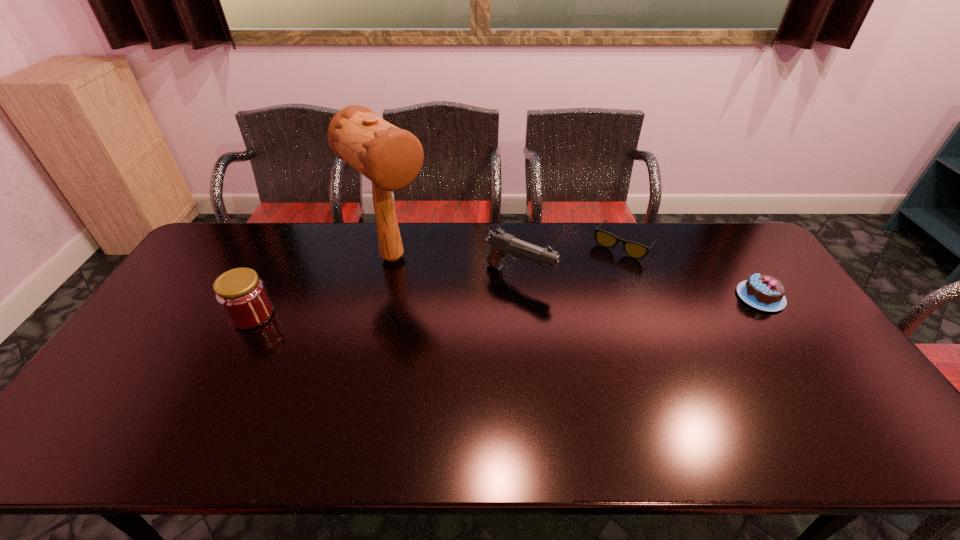
At what (x,y) coordinates should I click in order to perform the action: click on vacant space that's between the shortest object and the leftmost object. Please return your answer as a coordinate pair (x, y). The image size is (960, 540). Looking at the image, I should click on (438, 280).

Where is `free space between the leftmost object and the tallest object`? free space between the leftmost object and the tallest object is located at coordinates (323, 286).

This screenshot has height=540, width=960. In order to click on free space that is in between the second object from left to right and the rightmost object in this screenshot , I will do point(577,278).

In order to click on free space between the third object from right to left and the mallet in this screenshot , I will do `click(456, 267)`.

What are the coordinates of `vacant space that's between the third object from right to left and the shortest object` in the screenshot? It's located at (571, 260).

Identify the location of empty space that is in between the chocolate cake and the leftmost object. The image size is (960, 540). (506, 306).

At what (x,y) coordinates should I click in order to perform the action: click on free space between the jam and the fourth object from right to left. Please return your answer as a coordinate pair (x, y). The height and width of the screenshot is (540, 960). Looking at the image, I should click on (323, 286).

Identify the location of free space between the gun and the chocolate cake. (640, 287).

Identify which object is located as the third nearest to the rightmost object. Please provide its 2D coordinates. Your answer should be formatted as a tuple, i.e. [(x, y)], where the tuple contains the x and y coordinates of a point satisfying the conditions above.

[(390, 157)]

The image size is (960, 540). What are the coordinates of `object that is the closest to the fourth object from right to left` in the screenshot? It's located at (503, 244).